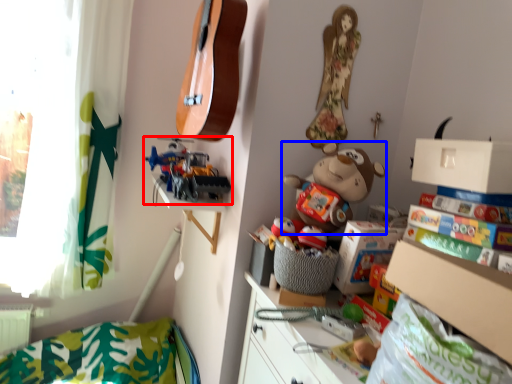
Question: Which object is closer to the camera taking this photo, toy (highlighted by a red box) or toy (highlighted by a blue box)?

Choices:
 (A) toy
 (B) toy

Answer: (B)